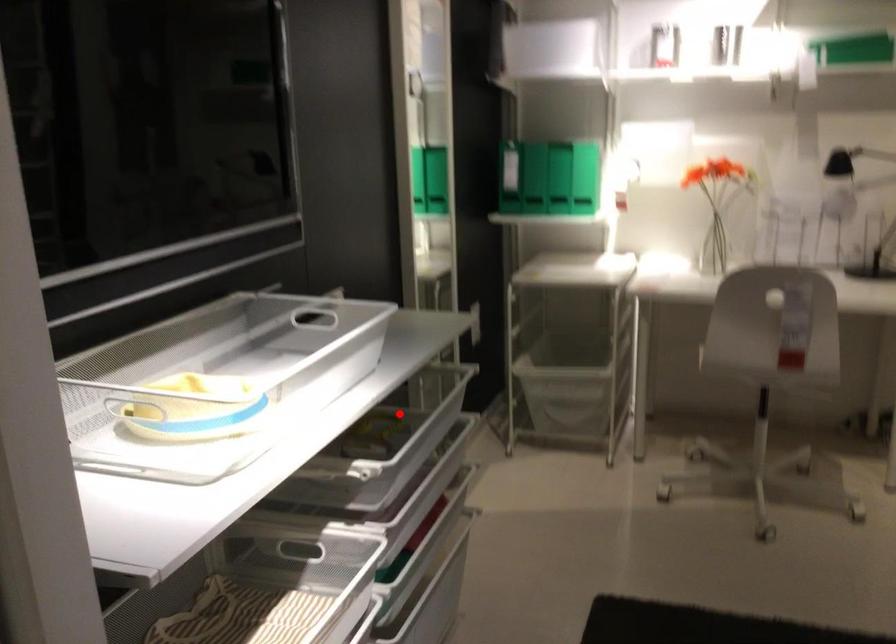
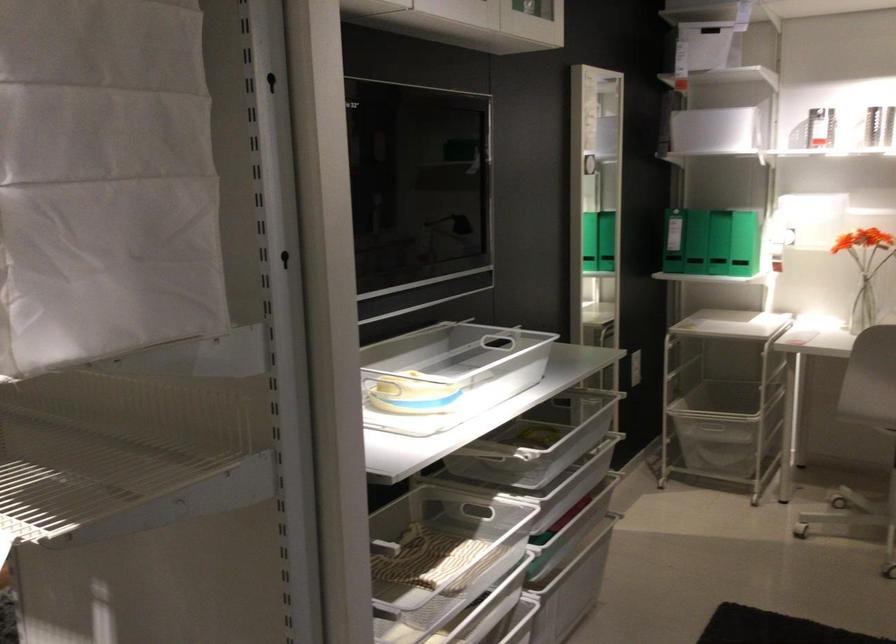
Question: I am providing you with two images of the same scene from different viewpoints. Given a red point in image1, look at the same physical point in image2. Is it:

Choices:
 (A) Closer to the viewpoint
 (B) Farther from the viewpoint

Answer: (B)